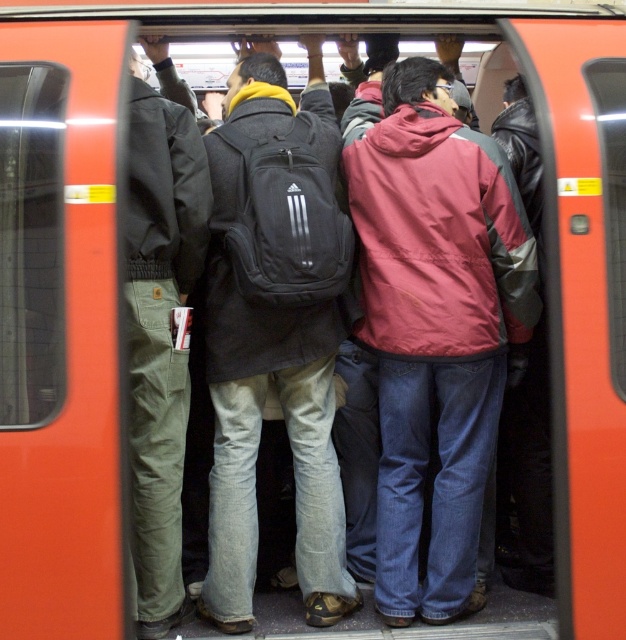
Does red nylon jacket at center lie in front of black fabric backpack at center?

No, it is behind black fabric backpack at center.

Where is `red nylon jacket at center`? red nylon jacket at center is located at coordinates (434, 326).

Consider the image. Which is more to the left, black fabric backpack at center or olive green corduroy pants at left?

From the viewer's perspective, olive green corduroy pants at left appears more on the left side.

Describe the element at coordinates (275, 330) in the screenshot. The width and height of the screenshot is (626, 640). I see `black fabric backpack at center` at that location.

Is point (331, 577) in front of point (183, 257)?

No.

Find the location of `black fabric backpack at center`. black fabric backpack at center is located at coordinates (275, 330).

Does red nylon jacket at center have a greater height compared to olive green corduroy pants at left?

No.

Who is positioned more to the right, red nylon jacket at center or olive green corduroy pants at left?

red nylon jacket at center

Identify the location of red nylon jacket at center. This screenshot has width=626, height=640. [x=434, y=326].